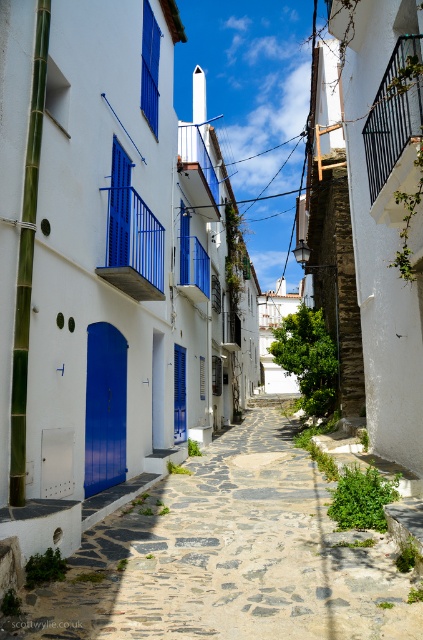
Question: Considering the relative positions of stone paved path at center and black metal balcony at upper right in the image provided, where is stone paved path at center located with respect to black metal balcony at upper right?

Choices:
 (A) left
 (B) right

Answer: (A)

Question: Where is stone paved path at center located in relation to black metal balcony at upper right in the image?

Choices:
 (A) below
 (B) above

Answer: (A)

Question: Can you confirm if blue painted metal railing at center is bigger than black metal balcony at upper right?

Choices:
 (A) no
 (B) yes

Answer: (B)

Question: Considering the real-world distances, which object is farthest from the black metal balcony at upper right?

Choices:
 (A) blue painted metal balcony at center
 (B) blue painted metal railing at center
 (C) stone paved path at center

Answer: (A)

Question: Estimate the real-world distances between objects in this image. Which object is farther from the stone paved path at center?

Choices:
 (A) black metal balcony at upper right
 (B) blue painted metal balcony at center

Answer: (B)

Question: Estimate the real-world distances between objects in this image. Which object is farther from the stone paved path at center?

Choices:
 (A) blue painted metal balcony at center
 (B) black metal balcony at upper right

Answer: (A)